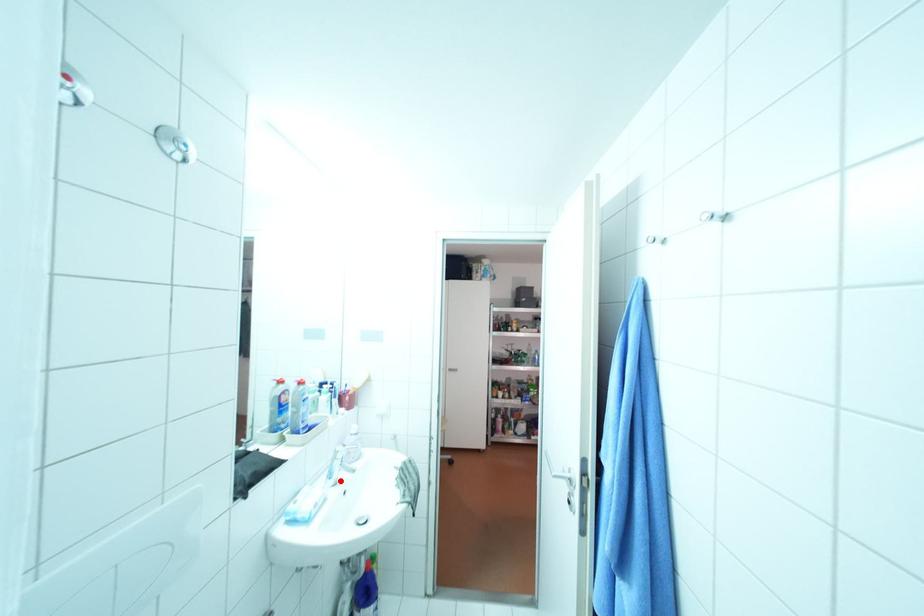
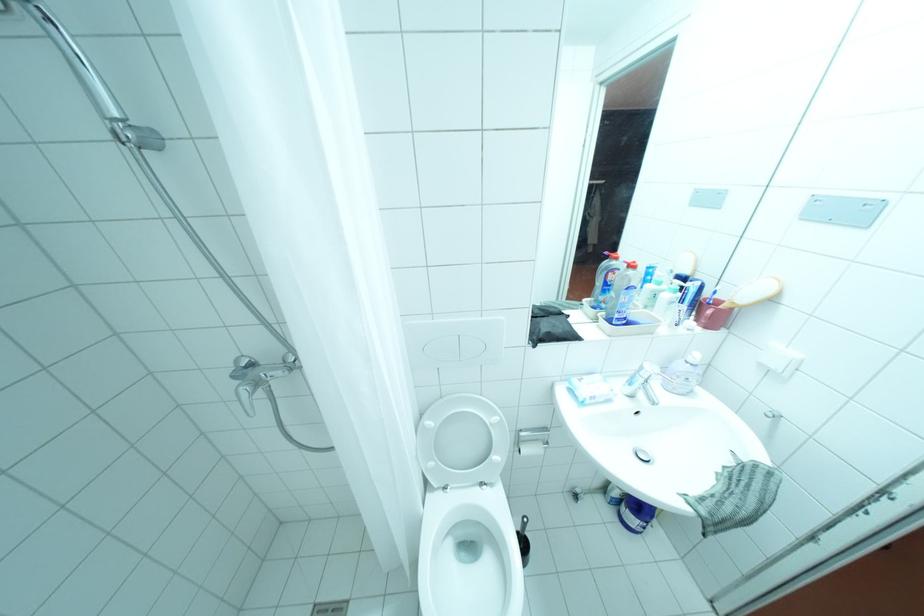
Find the pixel in the second image that matches the highlighted location in the first image.

(638, 390)